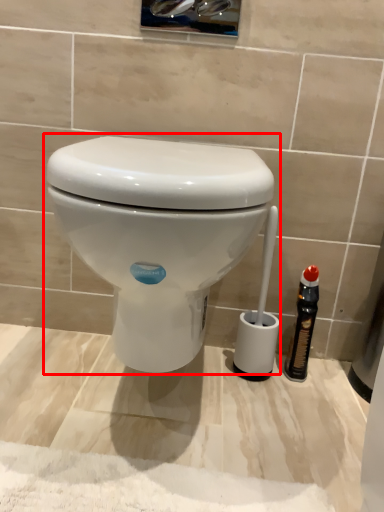
Question: From the image, what is the correct spatial relationship of toilet (annotated by the red box) in relation to bottle?

Choices:
 (A) right
 (B) left

Answer: (B)